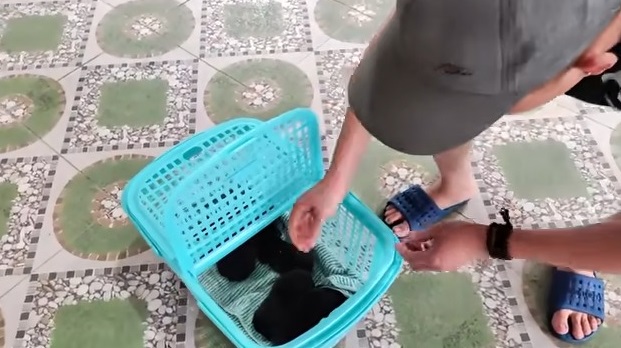
Find the location of a particular element. The width and height of the screenshot is (621, 348). blue basket is located at coordinates (148, 222).